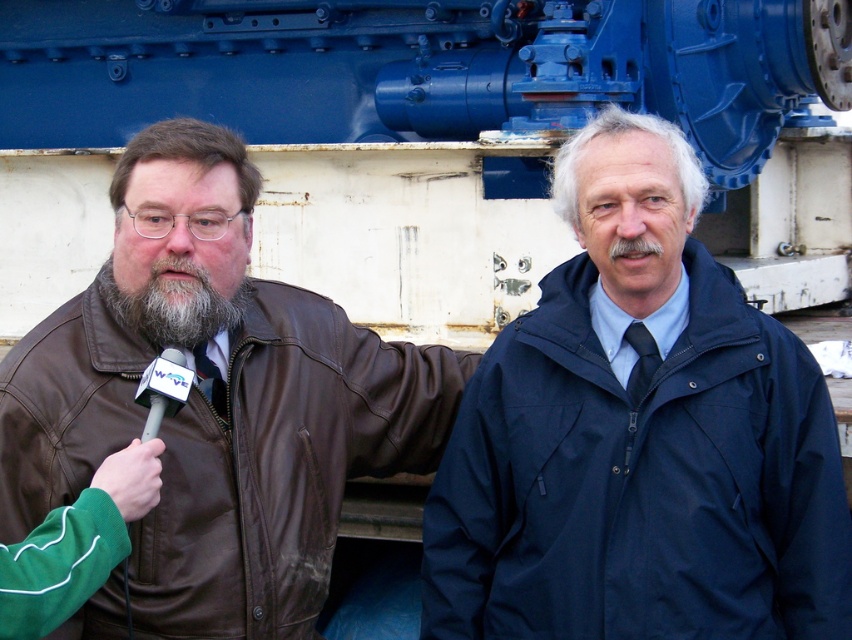
Question: Does navy blue waterproof jacket at right appear on the left side of white plastic microphone at left?

Choices:
 (A) no
 (B) yes

Answer: (A)

Question: Which is farther from the brown leather jacket at left?

Choices:
 (A) graywoollybeard at left
 (B) navy blue waterproof jacket at right
 (C) white plastic microphone at left

Answer: (B)

Question: Is the position of graywoollybeard at left more distant than that of white plastic microphone at left?

Choices:
 (A) yes
 (B) no

Answer: (A)

Question: Estimate the real-world distances between objects in this image. Which object is farther from the white plastic microphone at left?

Choices:
 (A) graywoollybeard at left
 (B) navy blue waterproof jacket at right
 (C) brown leather jacket at left

Answer: (B)

Question: Which object is farther from the camera taking this photo?

Choices:
 (A) navy blue waterproof jacket at right
 (B) graywoollybeard at left

Answer: (B)

Question: Can you confirm if navy blue waterproof jacket at right is thinner than graywoollybeard at left?

Choices:
 (A) no
 (B) yes

Answer: (A)